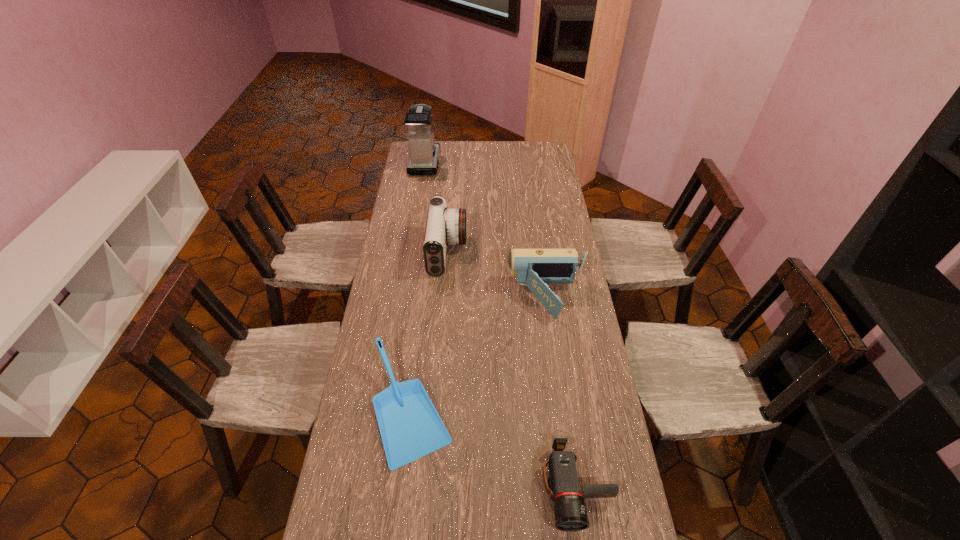
Find the location of a particular element. Image resolution: width=960 pixels, height=540 pixels. coffee maker is located at coordinates (424, 151).

You are a GUI agent. You are given a task and a screenshot of the screen. Output one action in this format:
    pyautogui.click(x=<x>, y=<y>)
    Task: Click on the farthest object
    
    Given the screenshot: What is the action you would take?
    pyautogui.click(x=424, y=151)

Locate an element on the screen. the leftmost camcorder is located at coordinates (445, 226).

Where is `the fourth shortest object`? the fourth shortest object is located at coordinates point(445,226).

This screenshot has width=960, height=540. Identify the location of the second shortest camcorder. (534, 268).

This screenshot has width=960, height=540. Identify the location of the fourth tallest object. (410, 427).

The image size is (960, 540). Find the location of `the shortest object`. the shortest object is located at coordinates (570, 511).

In order to click on the nearest camcorder in this screenshot , I will do `click(570, 511)`.

Identify the location of vacant space located at the front of the coffee maker where the controls are located. (455, 163).

Where is `vacant region located 0.140m on the surface of the tallest camcorder`? vacant region located 0.140m on the surface of the tallest camcorder is located at coordinates (500, 252).